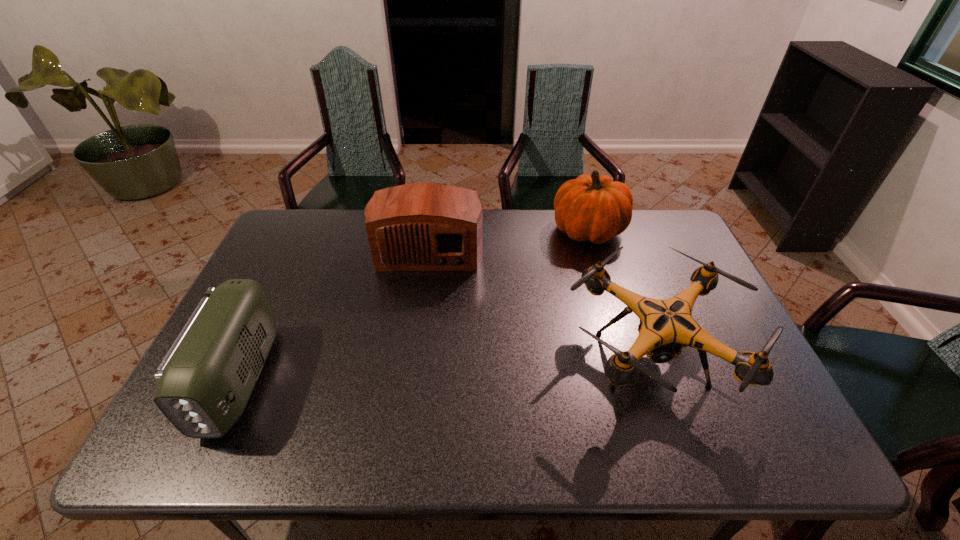
Locate an element on the screen. vacant area that lies between the right radio_receiver and the leftmost object is located at coordinates (334, 313).

The width and height of the screenshot is (960, 540). Find the location of `free space between the leftmost object and the drone`. free space between the leftmost object and the drone is located at coordinates (445, 369).

Locate an element on the screen. Image resolution: width=960 pixels, height=540 pixels. unoccupied position between the right radio_receiver and the leftmost object is located at coordinates (334, 313).

You are a GUI agent. You are given a task and a screenshot of the screen. Output one action in this format:
    pyautogui.click(x=<x>, y=<y>)
    Task: Click on the free space that is in between the farther radio_receiver and the nearer radio_receiver
    
    Given the screenshot: What is the action you would take?
    pyautogui.click(x=334, y=313)

Where is `vacant point located between the nearer radio_receiver and the right radio_receiver`? Image resolution: width=960 pixels, height=540 pixels. vacant point located between the nearer radio_receiver and the right radio_receiver is located at coordinates (334, 313).

Find the location of `free space between the drone and the nearer radio_receiver`. free space between the drone and the nearer radio_receiver is located at coordinates (445, 369).

The height and width of the screenshot is (540, 960). I want to click on free space between the right radio_receiver and the pumpkin, so click(509, 239).

This screenshot has width=960, height=540. Find the location of `free spot between the left radio_receiver and the drone`. free spot between the left radio_receiver and the drone is located at coordinates (445, 369).

This screenshot has width=960, height=540. I want to click on free spot between the second object from left to right and the pumpkin, so click(509, 239).

This screenshot has height=540, width=960. I want to click on the second closest object to the pumpkin, so click(x=425, y=226).